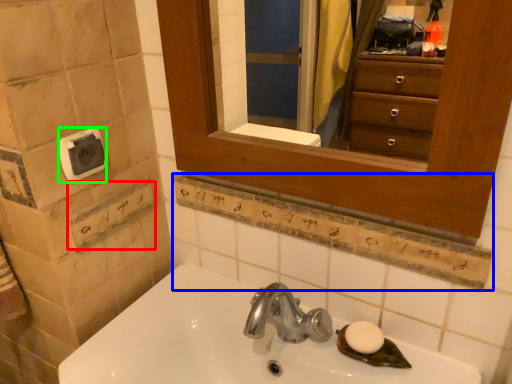
Question: Considering the real-world distances, which object is farthest from square (highlighted by a red box)? ledge (highlighted by a blue box) or towel bar (highlighted by a green box)?

Choices:
 (A) ledge
 (B) towel bar

Answer: (A)